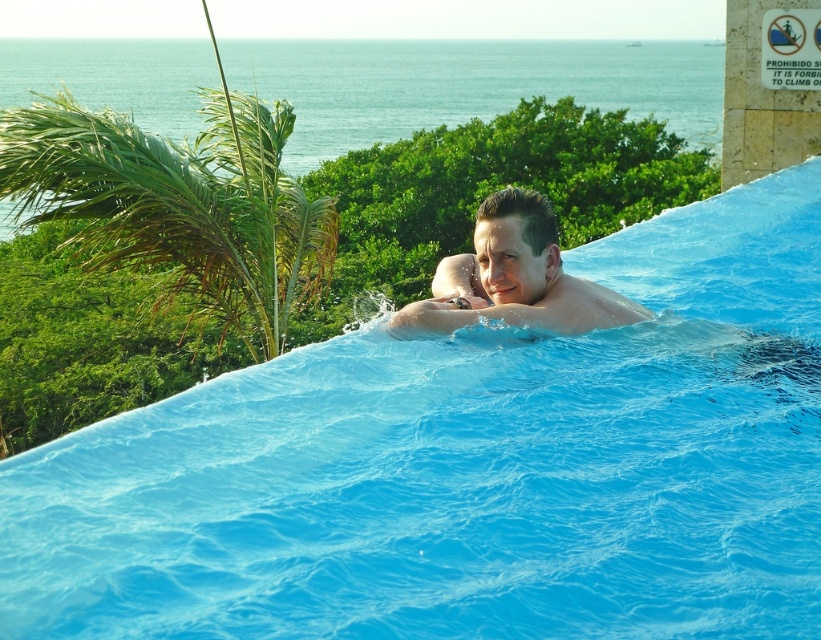
Question: Does green leafy palm tree at upper left have a larger size compared to smooth skin man at center?

Choices:
 (A) no
 (B) yes

Answer: (B)

Question: Is green leafy palm tree at upper left thinner than smooth skin man at center?

Choices:
 (A) no
 (B) yes

Answer: (A)

Question: Which point is farther to the camera?

Choices:
 (A) smooth skin man at center
 (B) green leafy palm tree at upper left

Answer: (B)

Question: Which point is farther to the camera?

Choices:
 (A) smooth skin man at center
 (B) green leafy palm tree at upper left

Answer: (B)

Question: Where is green leafy palm tree at upper left located in relation to smooth skin man at center in the image?

Choices:
 (A) below
 (B) above

Answer: (B)

Question: Among these objects, which one is farthest from the camera?

Choices:
 (A) green leafy palm tree at upper left
 (B) smooth skin man at center

Answer: (A)